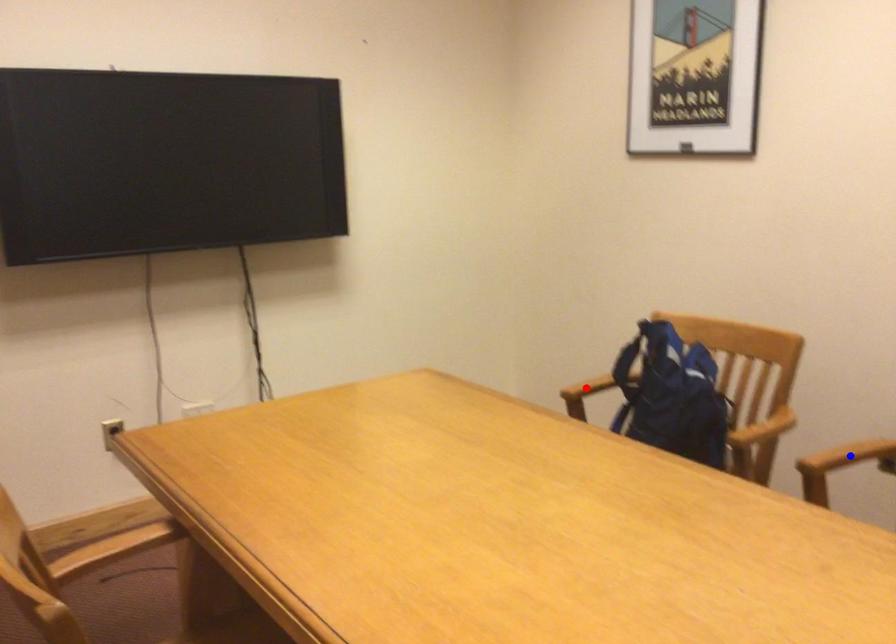
Question: Two points are marked on the image. Which point is closer to the camera?

Choices:
 (A) Blue point is closer.
 (B) Red point is closer.

Answer: (A)